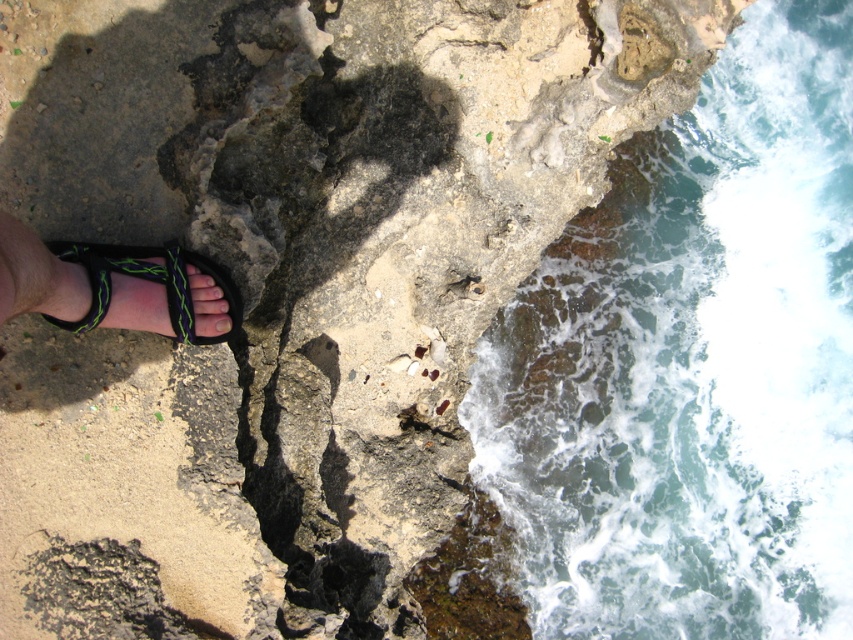
Question: Can you confirm if clear water at lower right is thinner than black woven sandal at lower left?

Choices:
 (A) yes
 (B) no

Answer: (B)

Question: Which is nearer to the clear water at lower right?

Choices:
 (A) black woven sandal at lower left
 (B) pale yellow nail at lower left

Answer: (A)

Question: Can you confirm if clear water at lower right is positioned above pale yellow nail at lower left?

Choices:
 (A) no
 (B) yes

Answer: (B)

Question: Which point is closer to the camera taking this photo?

Choices:
 (A) (189, 307)
 (B) (221, 326)

Answer: (A)

Question: Estimate the real-world distances between objects in this image. Which object is farther from the black woven sandal at lower left?

Choices:
 (A) clear water at lower right
 (B) pale yellow nail at lower left

Answer: (A)

Question: Does clear water at lower right have a lesser width compared to black woven sandal at lower left?

Choices:
 (A) no
 (B) yes

Answer: (A)